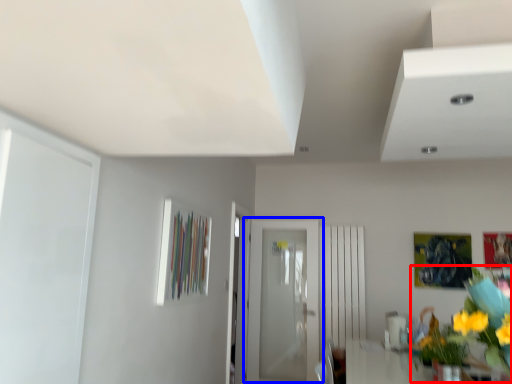
Question: Which object is closer to the camera taking this photo, floral arrangement (highlighted by a red box) or door (highlighted by a blue box)?

Choices:
 (A) floral arrangement
 (B) door

Answer: (A)